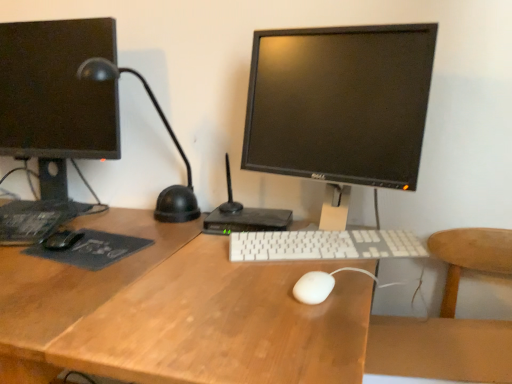
Where is `vacant space underneath dark gray matte mousepad at left (from a real-world perspective)`? Image resolution: width=512 pixels, height=384 pixels. vacant space underneath dark gray matte mousepad at left (from a real-world perspective) is located at coordinates (89, 247).